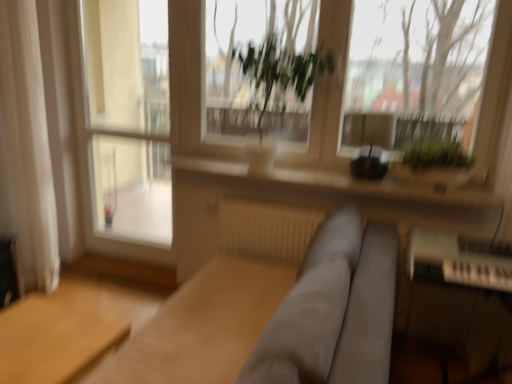
Locate an element on the screen. vacant area situated below green leafy plant at upper right, the 2th vegetation viewed from the left (from a real-world perspective) is located at coordinates (424, 184).